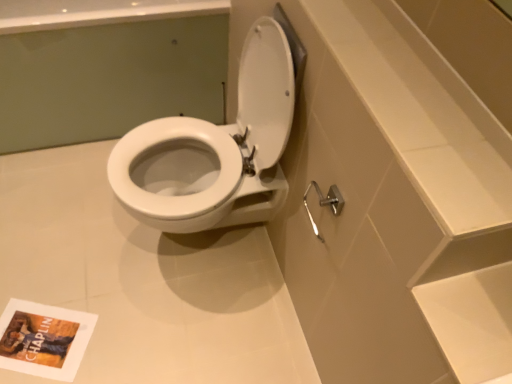
I want to click on white glossy toilet at center, so click(106, 67).

The image size is (512, 384). What do you see at coordinates (144, 280) in the screenshot?
I see `white glossy toilet at center` at bounding box center [144, 280].

This screenshot has height=384, width=512. I want to click on white glossy toilet at center, so click(106, 67).

Consider the image. Measure the distance from satin nickel shower arm at lower right to white glossy toilet at center.

satin nickel shower arm at lower right is 76.31 centimeters away from white glossy toilet at center.

Is point (310, 221) positioned after point (231, 245)?

That is False.

Is satin nickel shower arm at lower right situated inside white glossy toilet at center or outside?

satin nickel shower arm at lower right is spatially situated outside white glossy toilet at center.

Can you confirm if satin nickel shower arm at lower right is thinner than white glossy toilet at center?

Indeed, satin nickel shower arm at lower right has a lesser width compared to white glossy toilet at center.

Is satin nickel shower arm at lower right not within matte paper book cover at lower left?

Yes, satin nickel shower arm at lower right is located beyond the bounds of matte paper book cover at lower left.

This screenshot has width=512, height=384. I want to click on shower on the right of matte paper book cover at lower left, so click(x=324, y=203).

Based on the photo, what's the angular difference between matte paper book cover at lower left and white glossy toilet at center's facing directions?

The angle between the facing direction of matte paper book cover at lower left and the facing direction of white glossy toilet at center is 25.5 degrees.

Is matte paper book cover at lower left facing towards white glossy toilet at center?

No, matte paper book cover at lower left does not turn towards white glossy toilet at center.

Based on the photo, is matte paper book cover at lower left further to camera compared to white glossy toilet at center?

No, it is not.

How many degrees apart are the facing directions of white glossy toilet at center and white glossy toilet at center?

91 degrees.

Measure the distance between white glossy toilet at center and white glossy toilet at center.

48.35 centimeters.

Between white glossy toilet at center and white glossy toilet at center, which one has smaller size?

white glossy toilet at center is smaller.

Is white glossy toilet at center wider than white glossy toilet at center?

Incorrect, the width of white glossy toilet at center does not surpass that of white glossy toilet at center.

Is white glossy toilet at center far from white glossy toilet at center?

No, white glossy toilet at center is in close proximity to white glossy toilet at center.

Based on the photo, between white glossy toilet at center and white glossy toilet at center, which one has smaller width?

white glossy toilet at center.

Is point (165, 302) more distant than point (8, 148)?

No, it is not.

Considering the sizes of objects white glossy toilet at center and white glossy toilet at center in the image provided, who is smaller, white glossy toilet at center or white glossy toilet at center?

white glossy toilet at center.

You are a GUI agent. You are given a task and a screenshot of the screen. Output one action in this format:
    pyautogui.click(x=<x>, y=<y>)
    Task: Click on the book cover directly beneath the satin nickel shower arm at lower right (from a real-world perspective)
    The height and width of the screenshot is (384, 512).
    Given the screenshot: What is the action you would take?
    pyautogui.click(x=44, y=339)

Is matte paper book cover at lower left closer to the viewer compared to satin nickel shower arm at lower right?

No, matte paper book cover at lower left is behind satin nickel shower arm at lower right.

Is matte paper book cover at lower left surrounding satin nickel shower arm at lower right?

Definitely not — satin nickel shower arm at lower right is not inside matte paper book cover at lower left.

What's the angular difference between white glossy toilet at center and satin nickel shower arm at lower right's facing directions?

The facing directions of white glossy toilet at center and satin nickel shower arm at lower right are 89.1 degrees apart.

Looking at their sizes, would you say white glossy toilet at center is wider or thinner than satin nickel shower arm at lower right?

Considering their sizes, white glossy toilet at center looks broader than satin nickel shower arm at lower right.

Considering the sizes of white glossy toilet at center and satin nickel shower arm at lower right in the image, is white glossy toilet at center taller or shorter than satin nickel shower arm at lower right?

In the image, white glossy toilet at center appears to be taller than satin nickel shower arm at lower right.

From a real-world perspective, is white glossy toilet at center above or below satin nickel shower arm at lower right?

white glossy toilet at center is situated lower than satin nickel shower arm at lower right in the real world.

This screenshot has height=384, width=512. I want to click on plain that is under the satin nickel shower arm at lower right (from a real-world perspective), so click(x=144, y=280).

Find the location of a particular element. The image size is (512, 384). book cover that appears on the left of satin nickel shower arm at lower right is located at coordinates (44, 339).

When comparing their distances from white glossy toilet at center, does matte paper book cover at lower left or white glossy toilet at center seem further?

matte paper book cover at lower left is positioned further to the anchor white glossy toilet at center.

Which object lies further to the anchor point matte paper book cover at lower left, white glossy toilet at center or white glossy toilet at center?

Based on the image, white glossy toilet at center appears to be further to matte paper book cover at lower left.

Based on their spatial positions, is satin nickel shower arm at lower right or white glossy toilet at center closer to white glossy toilet at center?

The object closer to white glossy toilet at center is white glossy toilet at center.

Estimate the real-world distances between objects in this image. Which object is closer to matte paper book cover at lower left, satin nickel shower arm at lower right or white glossy toilet at center?

Among the two, white glossy toilet at center is located nearer to matte paper book cover at lower left.

When comparing their distances from white glossy toilet at center, does white glossy toilet at center or satin nickel shower arm at lower right seem closer?

white glossy toilet at center.

From the image, which object appears to be nearer to white glossy toilet at center, white glossy toilet at center or satin nickel shower arm at lower right?

white glossy toilet at center is positioned closer to the anchor white glossy toilet at center.

Which object lies further to the anchor point satin nickel shower arm at lower right, matte paper book cover at lower left or white glossy toilet at center?

white glossy toilet at center is positioned further to the anchor satin nickel shower arm at lower right.

Considering their positions, is white glossy toilet at center positioned further to white glossy toilet at center than matte paper book cover at lower left?

Among the two, white glossy toilet at center is located further to white glossy toilet at center.

You are a GUI agent. You are given a task and a screenshot of the screen. Output one action in this format:
    pyautogui.click(x=<x>, y=<y>)
    Task: Click on the shower between white glossy toilet at center and matte paper book cover at lower left in the vertical direction
    This screenshot has width=512, height=384.
    Given the screenshot: What is the action you would take?
    pyautogui.click(x=324, y=203)

Locate an element on the screen. The height and width of the screenshot is (384, 512). plain that lies between white glossy toilet at center and matte paper book cover at lower left from top to bottom is located at coordinates (144, 280).

Identify the location of plain situated between matte paper book cover at lower left and satin nickel shower arm at lower right from left to right. (144, 280).

This screenshot has height=384, width=512. What are the coordinates of `shower that lies between white glossy toilet at center and white glossy toilet at center from top to bottom` in the screenshot? It's located at (324, 203).